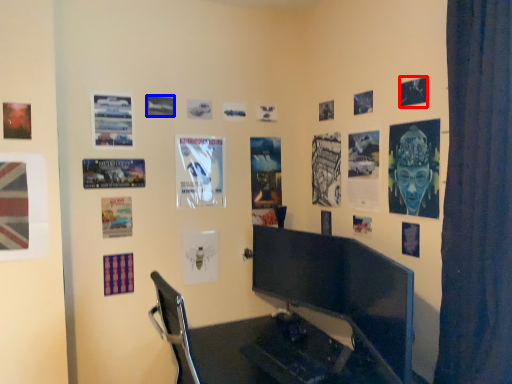
Question: Which of the following is the farthest to the observer, poster page (highlighted by a red box) or poster page (highlighted by a blue box)?

Choices:
 (A) poster page
 (B) poster page

Answer: (B)